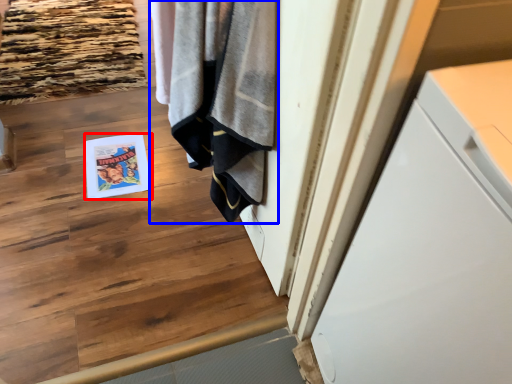
Question: Which object is further to the camera taking this photo, magazine (highlighted by a red box) or bath towel (highlighted by a blue box)?

Choices:
 (A) magazine
 (B) bath towel

Answer: (A)